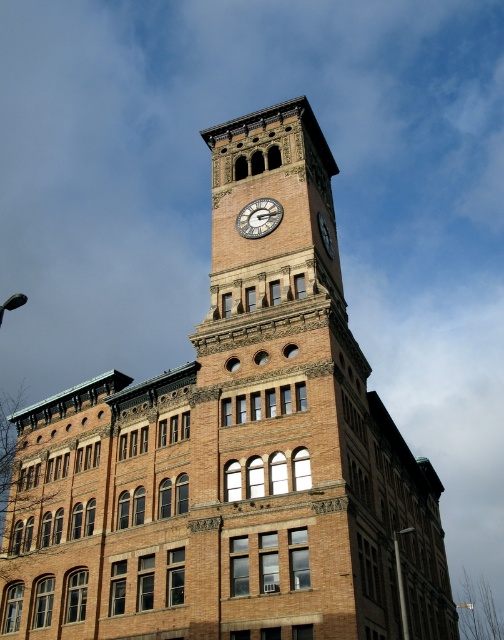
Question: Does brass clock face at center have a larger size compared to dark brown stone clock at upper center?

Choices:
 (A) no
 (B) yes

Answer: (B)

Question: Which point appears closest to the camera in this image?

Choices:
 (A) (329, 253)
 (B) (266, 220)

Answer: (B)

Question: Can you confirm if brass clock face at center is wider than dark brown stone clock at upper center?

Choices:
 (A) no
 (B) yes

Answer: (B)

Question: Can you confirm if brass clock face at center is positioned below dark brown stone clock at upper center?

Choices:
 (A) no
 (B) yes

Answer: (A)